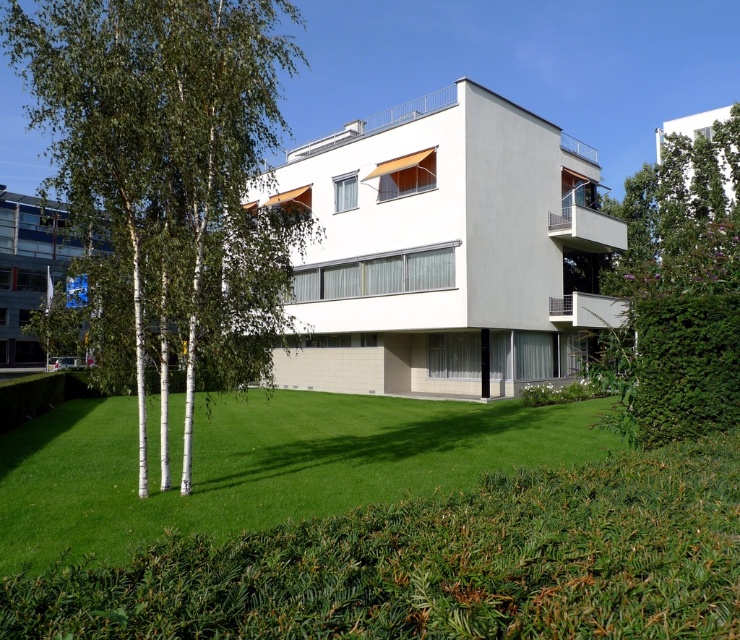
You are standing in front of the residential building and see the green leafy tree at left and the green leafy tree at upper right. Which tree is located more to the left side of the scene?

The green leafy tree at left is positioned on the left side of green leafy tree at upper right, so the green leafy tree at left is more to the left side of the scene.

You are standing in front of the residential building and want to take a photo of the green leafy tree at left. If your camera has a maximum focus range of 7 meters, will you need to move closer to the tree to capture it clearly?

The green leafy tree at left is 7.71 meters away from camera. Since the maximum focus range is 7 meters, you need to move closer to the tree to capture it clearly.

From the picture: You are standing at the point labeled as point (x=169, y=172) in the image. What can you see in the direction of the residential building?

The point labeled (x=169, y=172) indicates a green leafy tree at left, so standing there, you would see the residential building in front of you with its white structure and large windows.